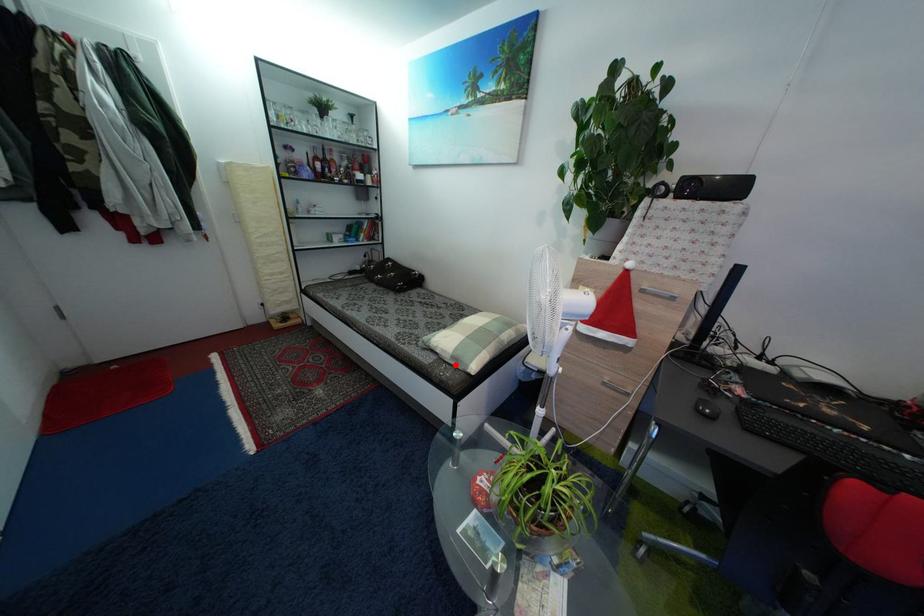
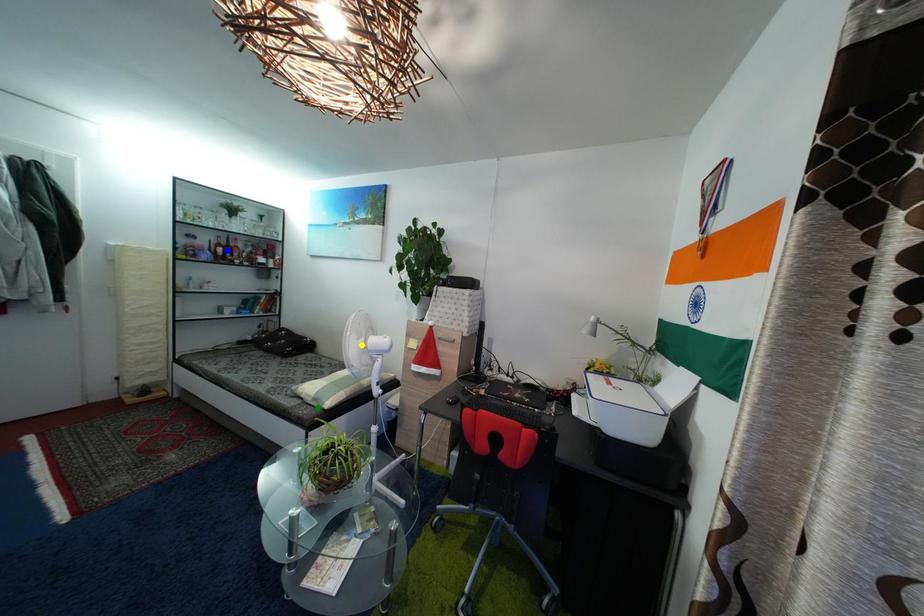
Question: I am providing you with two images of the same scene from different viewpoints. A red point is marked on the first image. You are given multiple points on the second image. Which point in image 2 is actually the same real-world point as the red point in image 1?

Choices:
 (A) green point
 (B) yellow point
 (C) blue point

Answer: (A)